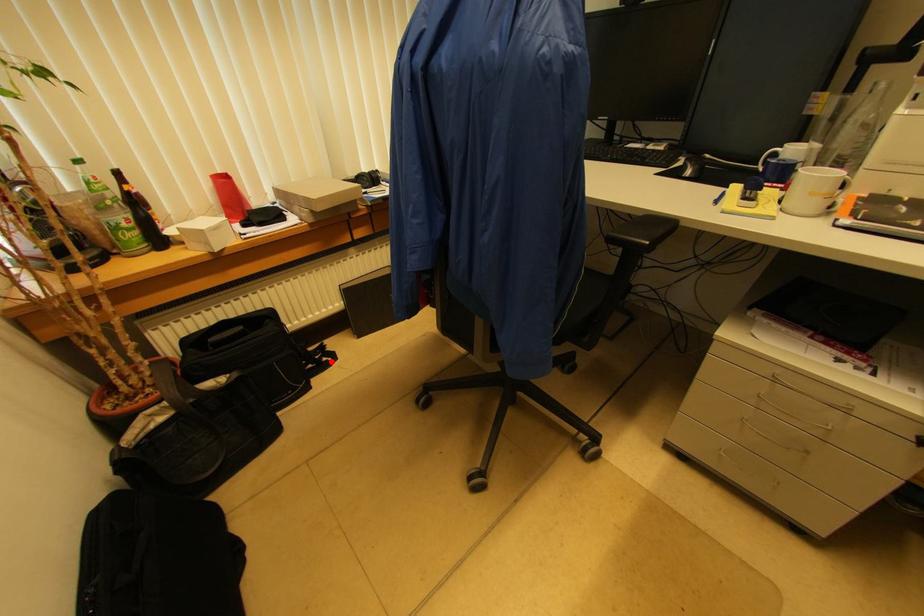
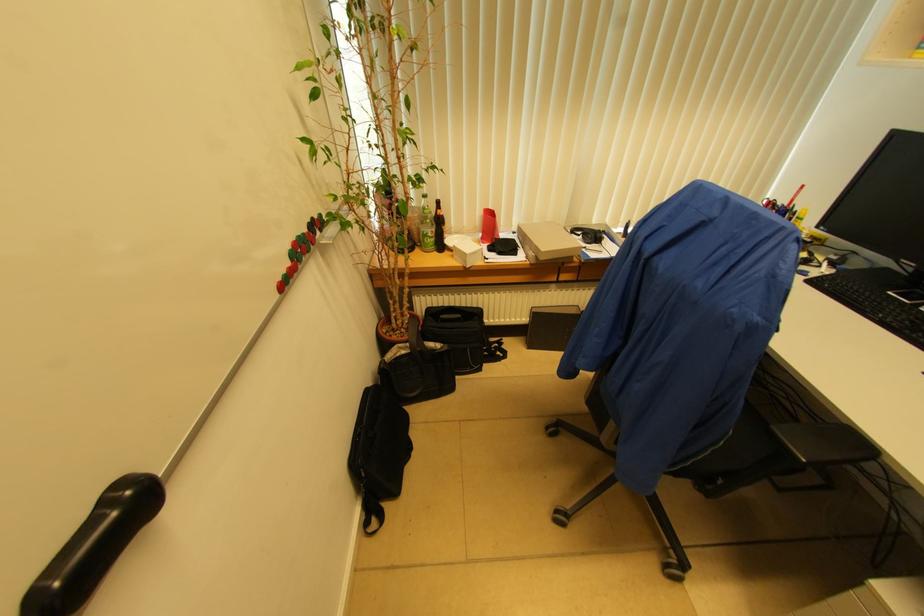
Locate, in the second image, the point that corresponds to the highlighted location in the first image.

(503, 358)